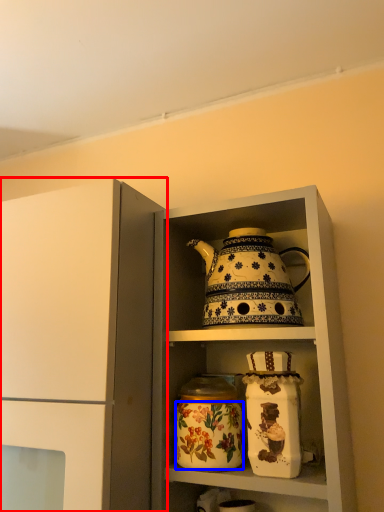
Question: Which object is closer to the camera taking this photo, cupboard (highlighted by a red box) or flower (highlighted by a blue box)?

Choices:
 (A) cupboard
 (B) flower

Answer: (A)